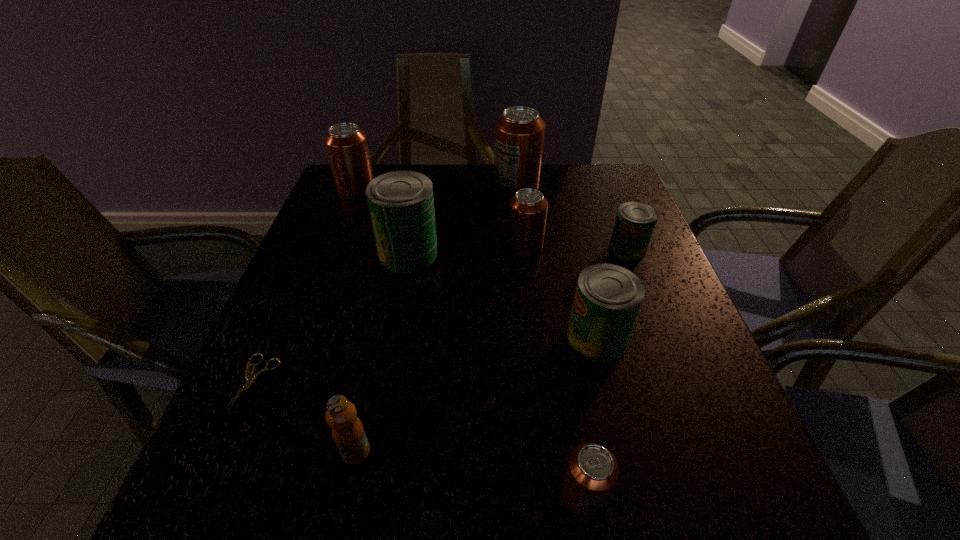
Where is `vacant area that lies between the rightmost can and the second smallest orange can`? Image resolution: width=960 pixels, height=540 pixels. vacant area that lies between the rightmost can and the second smallest orange can is located at coordinates (576, 248).

Locate an element on the screen. free spot between the second nearest orange can and the second green can from right to left is located at coordinates (561, 292).

At what (x,y) coordinates should I click in order to perform the action: click on blank region between the third smallest orange can and the third biggest orange can. Please return your answer as a coordinate pair (x, y). Looking at the image, I should click on (441, 218).

This screenshot has height=540, width=960. Find the location of `vacant space that is in between the second biggest green can and the second biggest orange can`. vacant space that is in between the second biggest green can and the second biggest orange can is located at coordinates (476, 264).

You are a GUI agent. You are given a task and a screenshot of the screen. Output one action in this format:
    pyautogui.click(x=<x>, y=<y>)
    Task: Click on the vacant area that lies between the sixth farthest can and the leftmost orange can
    This screenshot has height=540, width=960.
    Given the screenshot: What is the action you would take?
    pyautogui.click(x=476, y=264)

Select which object appears as the fifth closest to the nearest green can. Please provide its 2D coordinates. Your answer should be formatted as a tuple, i.e. [(x, y)], where the tuple contains the x and y coordinates of a point satisfying the conditions above.

[(348, 433)]

Locate which object is the third closest to the tallest object. Please provide its 2D coordinates. Your answer should be formatted as a tuple, i.e. [(x, y)], where the tuple contains the x and y coordinates of a point satisfying the conditions above.

[(635, 221)]

You are a GUI agent. You are given a task and a screenshot of the screen. Output one action in this format:
    pyautogui.click(x=<x>, y=<y>)
    Task: Click on the can that stands as the third closest to the tallest object
    Image resolution: width=960 pixels, height=540 pixels.
    Given the screenshot: What is the action you would take?
    pyautogui.click(x=635, y=221)

Identify which can is the seventh nearest to the beige shears. Please provide its 2D coordinates. Your answer should be formatted as a tuple, i.e. [(x, y)], where the tuple contains the x and y coordinates of a point satisfying the conditions above.

[(635, 221)]

This screenshot has height=540, width=960. I want to click on orange can object that ranks as the third closest to the rightmost green can, so click(592, 472).